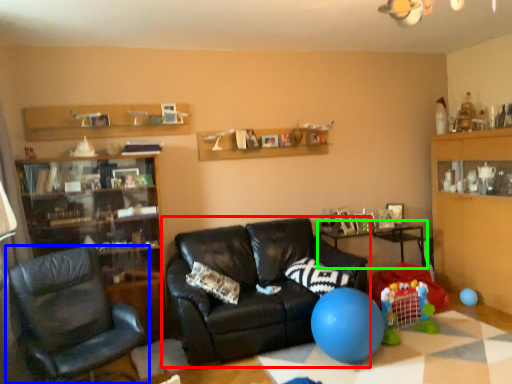
Question: Which is nearer to the studio couch (highlighted by a red box)? chair (highlighted by a blue box) or table (highlighted by a green box).

Choices:
 (A) chair
 (B) table

Answer: (A)